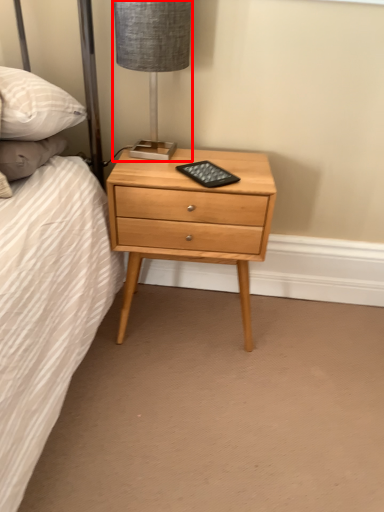
Question: From the image's perspective, what is the correct spatial relationship of table lamp (annotated by the red box) in relation to nightstand?

Choices:
 (A) below
 (B) above

Answer: (B)